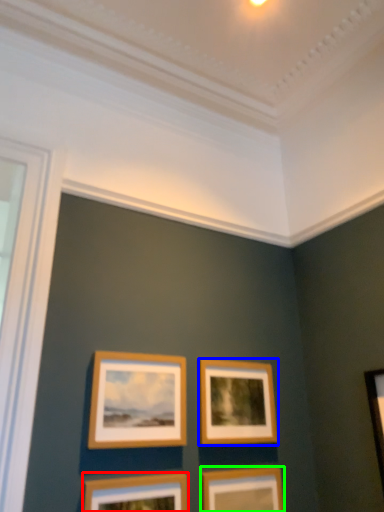
Question: Which object is positioned farthest from picture frame (highlighted by a red box)? Select from picture frame (highlighted by a blue box) and picture frame (highlighted by a green box).

Choices:
 (A) picture frame
 (B) picture frame

Answer: (A)